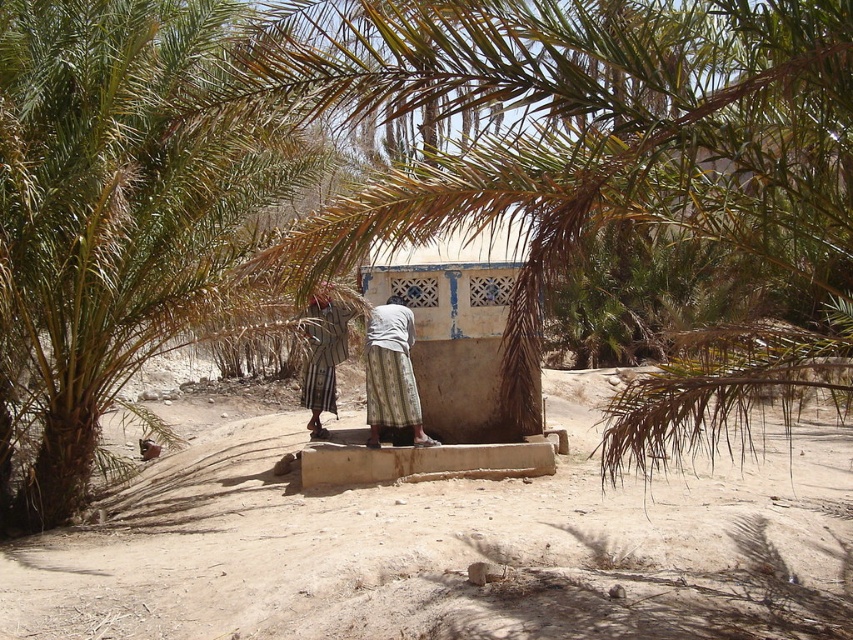
Question: Which point is farther to the camera?

Choices:
 (A) (370, 426)
 (B) (328, 384)
 (C) (194, 520)

Answer: (B)

Question: Does dusty sand at center appear under green leafy palm tree at left?

Choices:
 (A) no
 (B) yes

Answer: (B)

Question: Which of the following is the closest to the observer?

Choices:
 (A) printed fabric skirt at center
 (B) green leafy palm tree at left
 (C) white textured dress at center
 (D) dusty sand at center

Answer: (D)

Question: Is dusty sand at center positioned at the back of green leafy palm tree at left?

Choices:
 (A) no
 (B) yes

Answer: (A)

Question: Considering the real-world distances, which object is closest to the green leafy palm tree at left?

Choices:
 (A) printed fabric skirt at center
 (B) dusty sand at center
 (C) white textured dress at center

Answer: (C)

Question: Observing the image, what is the correct spatial positioning of dusty sand at center in reference to green leafy palm tree at left?

Choices:
 (A) above
 (B) below

Answer: (B)